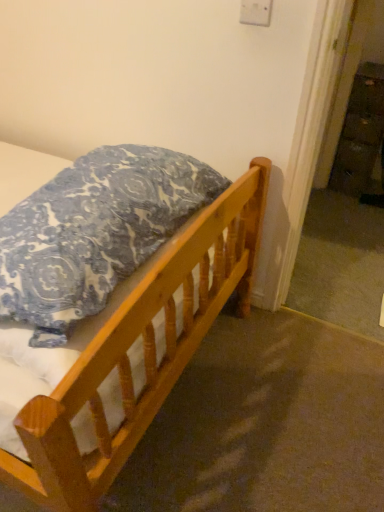
Question: From the image's perspective, is wooden dresser at right above wooden bed at lower left?

Choices:
 (A) yes
 (B) no

Answer: (A)

Question: Is wooden dresser at right facing towards wooden bed at lower left?

Choices:
 (A) yes
 (B) no

Answer: (A)

Question: Considering the relative sizes of wooden dresser at right and wooden bed at lower left in the image provided, is wooden dresser at right smaller than wooden bed at lower left?

Choices:
 (A) no
 (B) yes

Answer: (B)

Question: Is wooden dresser at right positioned with its back to wooden bed at lower left?

Choices:
 (A) yes
 (B) no

Answer: (B)

Question: Does wooden dresser at right come behind wooden bed at lower left?

Choices:
 (A) no
 (B) yes

Answer: (B)

Question: From a real-world perspective, is wooden dresser at right physically located above or below wooden bed at lower left?

Choices:
 (A) above
 (B) below

Answer: (A)

Question: Do you think wooden dresser at right is within wooden bed at lower left, or outside of it?

Choices:
 (A) inside
 (B) outside

Answer: (B)

Question: From the image's perspective, is wooden dresser at right positioned above or below wooden bed at lower left?

Choices:
 (A) above
 (B) below

Answer: (A)

Question: Is point 362,138 positioned closer to the camera than point 119,456?

Choices:
 (A) farther
 (B) closer

Answer: (A)

Question: Is blue patterned pillow at upper left inside or outside of wooden bed at lower left?

Choices:
 (A) outside
 (B) inside

Answer: (A)

Question: In the image, is blue patterned pillow at upper left positioned in front of or behind wooden bed at lower left?

Choices:
 (A) behind
 (B) front

Answer: (B)

Question: Is point (69, 238) closer or farther from the camera than point (147, 279)?

Choices:
 (A) farther
 (B) closer

Answer: (A)

Question: From the image's perspective, is blue patterned pillow at upper left positioned above or below wooden bed at lower left?

Choices:
 (A) below
 (B) above

Answer: (B)

Question: From a real-world perspective, is wooden bed at lower left above or below wooden dresser at right?

Choices:
 (A) below
 (B) above

Answer: (A)

Question: In terms of width, does wooden bed at lower left look wider or thinner when compared to wooden dresser at right?

Choices:
 (A) wide
 (B) thin

Answer: (A)